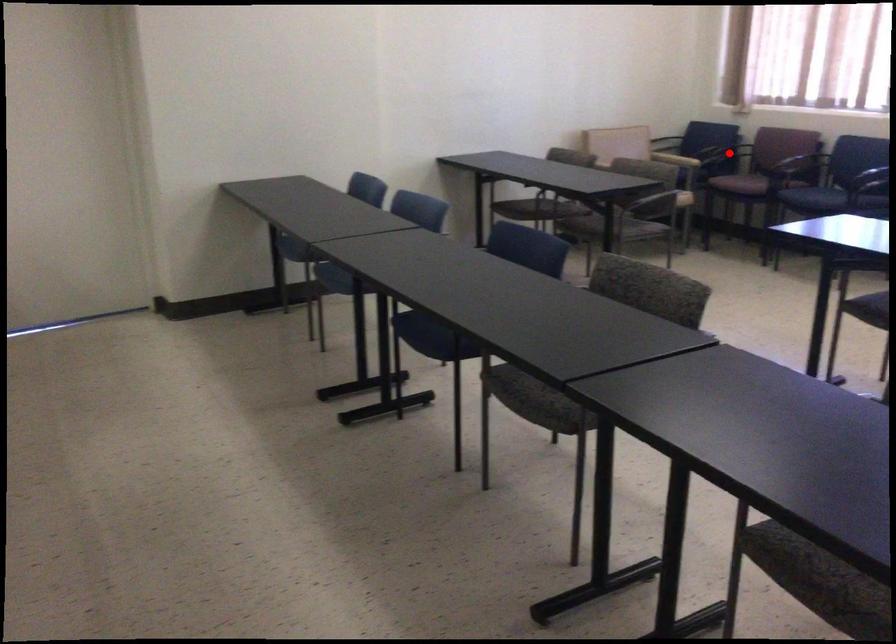
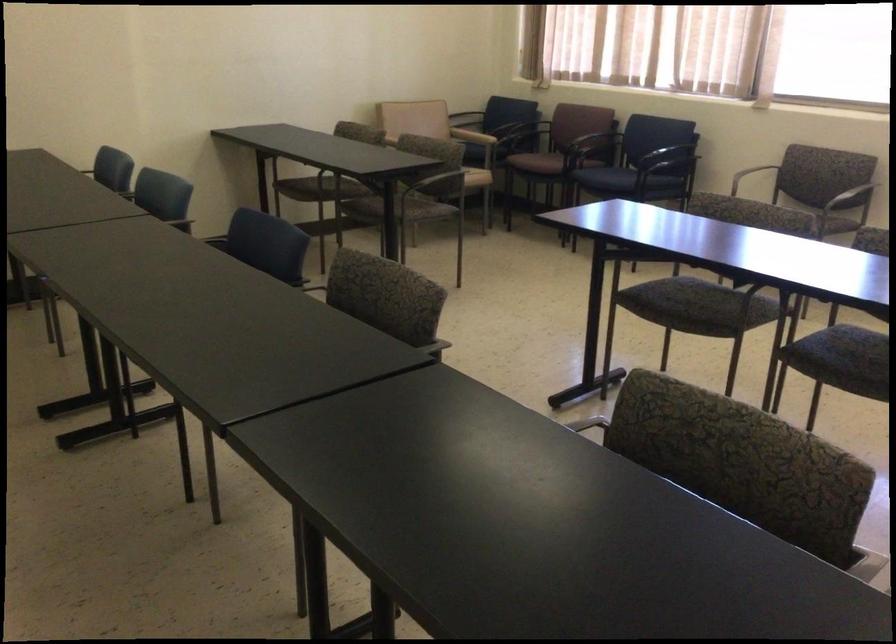
Question: I am providing you with two images of the same scene from different viewpoints. A red point is marked on the first image. Can you still see the location of the red point in image 2?

Choices:
 (A) Yes
 (B) No

Answer: (B)